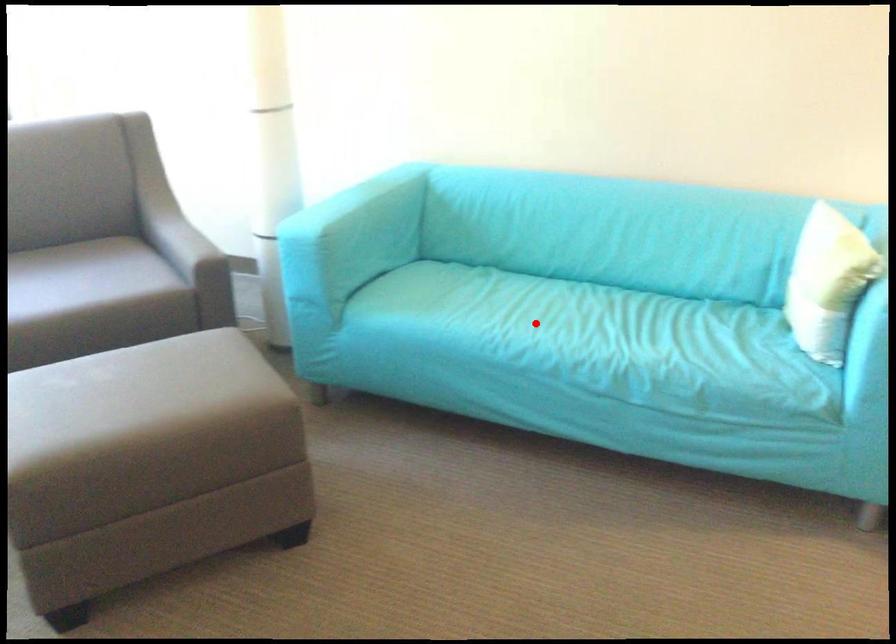
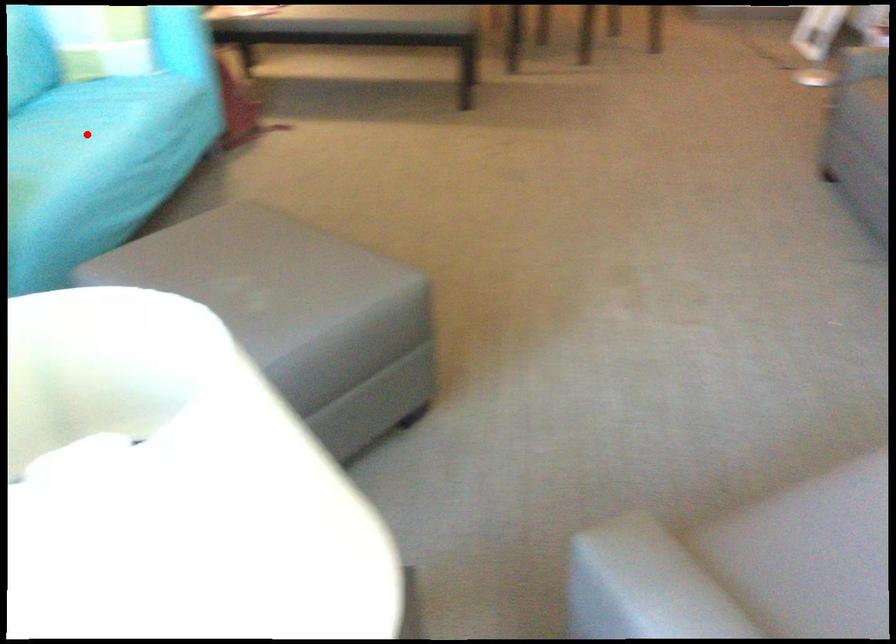
I am providing you with two images of the same scene from different viewpoints. A red point is marked on the first image and another point is marked on the second image. Is the marked point in image1 the same physical position as the marked point in image2?

Yes